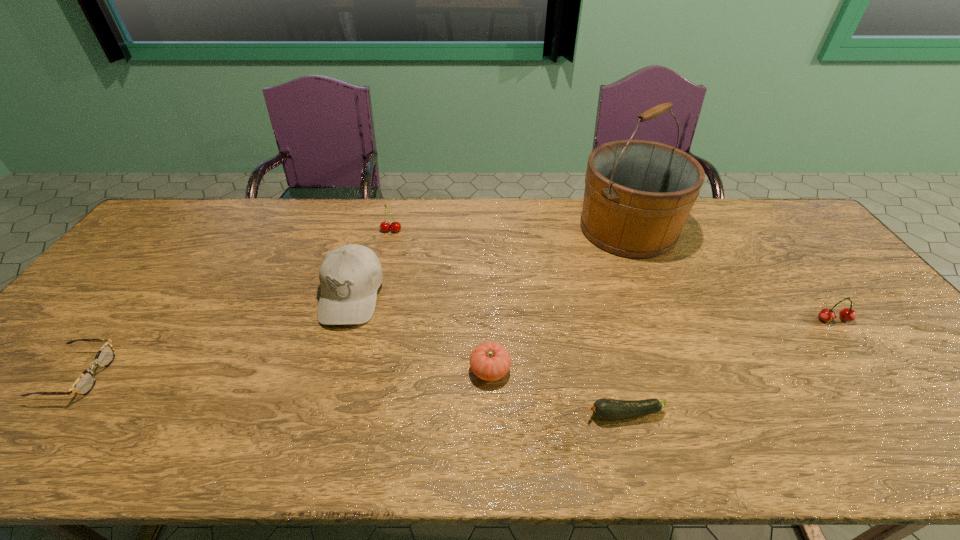
Find the location of `free space between the spectacles and the fourth object from left to right`. free space between the spectacles and the fourth object from left to right is located at coordinates (284, 373).

Find the location of a particular element. The width and height of the screenshot is (960, 540). free spot between the leftmost object and the zucchini is located at coordinates (351, 395).

Identify the location of empty space that is in between the leftmost object and the tomato. This screenshot has height=540, width=960. (284, 373).

You are a GUI agent. You are given a task and a screenshot of the screen. Output one action in this format:
    pyautogui.click(x=<x>, y=<y>)
    Task: Click on the unoccupied position between the nearest object and the spectacles
    This screenshot has height=540, width=960.
    Given the screenshot: What is the action you would take?
    pyautogui.click(x=351, y=395)

Where is `free space between the third shortest object and the left cherry`? The height and width of the screenshot is (540, 960). free space between the third shortest object and the left cherry is located at coordinates (441, 300).

Identify the location of free space that is in between the fifth tallest object and the zucchini. (557, 392).

Identify the location of free space that is in between the nearest object and the spectacles. This screenshot has height=540, width=960. (351, 395).

Where is `free spot between the zucchini and the nearer cherry`? The width and height of the screenshot is (960, 540). free spot between the zucchini and the nearer cherry is located at coordinates click(729, 367).

At what (x,y) coordinates should I click in order to perform the action: click on object identified as the fourth closest to the nearest object. Please return your answer as a coordinate pair (x, y). The image size is (960, 540). Looking at the image, I should click on (350, 275).

Find the location of a particular element. the closest object to the bucket is located at coordinates (847, 314).